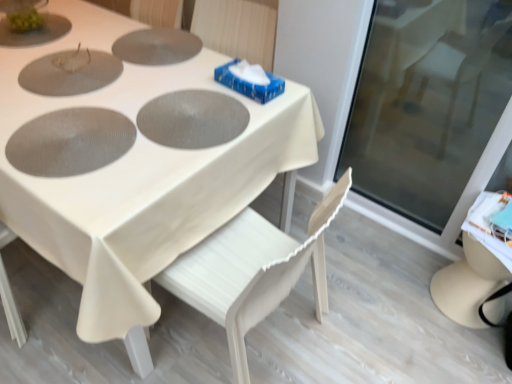
The height and width of the screenshot is (384, 512). I want to click on free point behind gray matte pizza pan at center, which is the second pizza pan in back-to-front order, so click(179, 64).